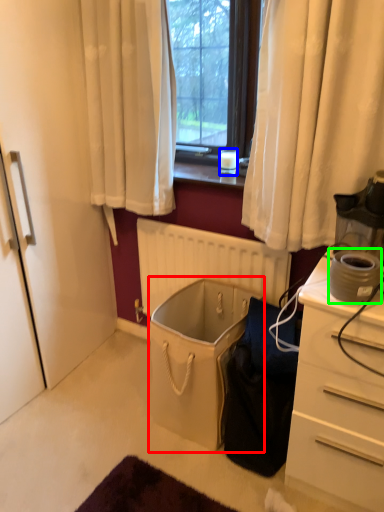
Question: Which object is positioned farthest from laundry basket (highlighted by a red box)? Select from coffee cup (highlighted by a blue box) and appliance (highlighted by a green box).

Choices:
 (A) coffee cup
 (B) appliance

Answer: (A)